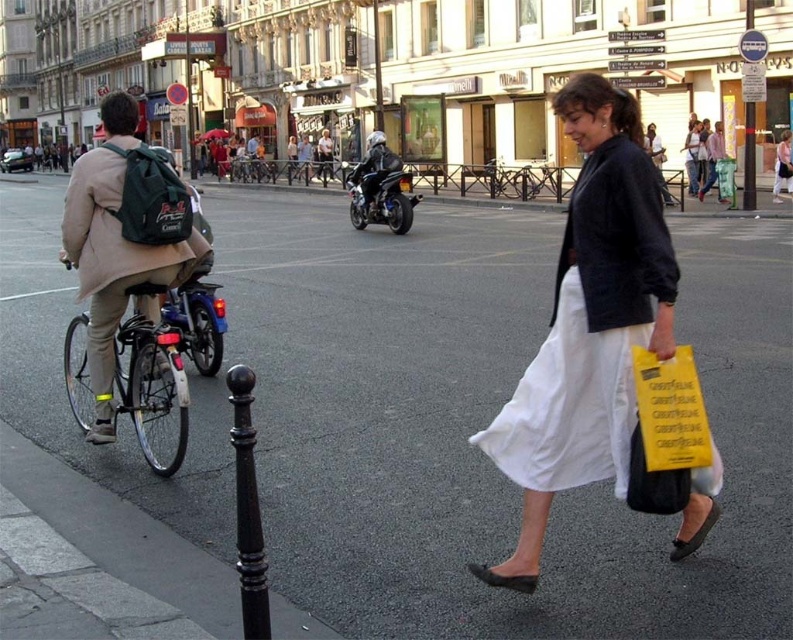
You are standing at the point marked by coordinates point (123, 237). Looking around, you see a matte green backpack at left. What object is located at your current position?

The point marked by coordinates point (123, 237) corresponds to the matte green backpack at left.

You are standing at the point labeled point (113,125) and want to walk to the point labeled point (81,384). Which direction should you move to get closer to your destination?

To move from point (113,125) to point (81,384), you should move towards the right and slightly forward since point (81,384) is further away from the viewer compared to your current position at point (113,125).

Based on the scene description, which object is taller between the white cotton dress at center and the white cotton skirt at lower right?

The white cotton skirt at lower right is taller than the white cotton dress at center.